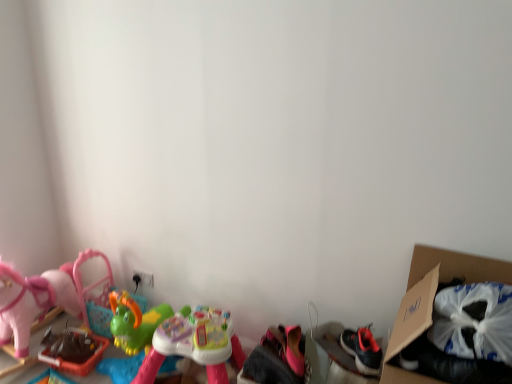
Question: Is multicolored plastic toy at center, the 2th toy when ordered from left to right, facing towards cardboard box at right?

Choices:
 (A) yes
 (B) no

Answer: (B)

Question: Is multicolored plastic toy at center, the second toy in the right-to-left sequence, closer to the viewer compared to cardboard box at right?

Choices:
 (A) no
 (B) yes

Answer: (A)

Question: Can you confirm if multicolored plastic toy at center, the second toy in the right-to-left sequence, is wider than cardboard box at right?

Choices:
 (A) yes
 (B) no

Answer: (B)

Question: Is multicolored plastic toy at center, the second toy in the right-to-left sequence, taller than cardboard box at right?

Choices:
 (A) no
 (B) yes

Answer: (A)

Question: Is multicolored plastic toy at center, the 2th toy when ordered from left to right, outside of cardboard box at right?

Choices:
 (A) yes
 (B) no

Answer: (A)

Question: From a real-world perspective, is multicolored plastic toy at center, the 2th toy when ordered from left to right, positioned under cardboard box at right based on gravity?

Choices:
 (A) no
 (B) yes

Answer: (B)

Question: From the image's perspective, is pink fabric shoes at lower center, acting as the 1th toy starting from the right, above rubberized green toy at lower left, which appears as the third toy when viewed from the right?

Choices:
 (A) no
 (B) yes

Answer: (B)

Question: Can you see pink fabric shoes at lower center, arranged as the 3th toy when viewed from the left, touching rubberized green toy at lower left, the first toy positioned from the left?

Choices:
 (A) no
 (B) yes

Answer: (A)

Question: Considering the relative sizes of pink fabric shoes at lower center, acting as the 1th toy starting from the right, and rubberized green toy at lower left, which appears as the third toy when viewed from the right, in the image provided, is pink fabric shoes at lower center, acting as the 1th toy starting from the right, thinner than rubberized green toy at lower left, which appears as the third toy when viewed from the right,?

Choices:
 (A) no
 (B) yes

Answer: (A)

Question: From a real-world perspective, is pink fabric shoes at lower center, acting as the 1th toy starting from the right, located higher than rubberized green toy at lower left, which appears as the third toy when viewed from the right?

Choices:
 (A) no
 (B) yes

Answer: (B)

Question: Is there a large distance between pink fabric shoes at lower center, acting as the 1th toy starting from the right, and rubberized green toy at lower left, which appears as the third toy when viewed from the right?

Choices:
 (A) no
 (B) yes

Answer: (A)

Question: Is pink fabric shoes at lower center, arranged as the 3th toy when viewed from the left, not inside rubberized green toy at lower left, the first toy positioned from the left?

Choices:
 (A) no
 (B) yes

Answer: (B)

Question: Is cardboard box at right far from pink fabric shoes at lower center, acting as the 1th toy starting from the right?

Choices:
 (A) yes
 (B) no

Answer: (B)